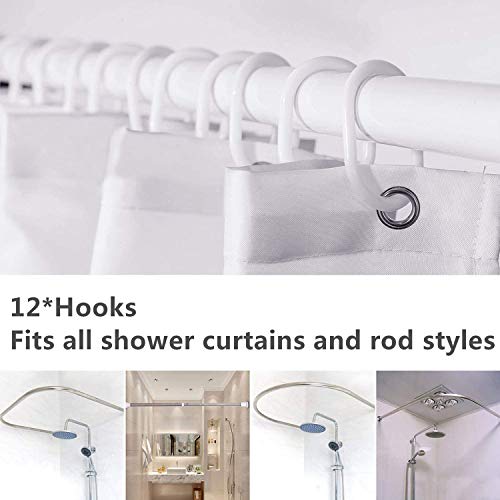
You are a GUI agent. You are given a task and a screenshot of the screen. Output one action in this format:
    pyautogui.click(x=<x>, y=<y>)
    Task: Click on the rod
    The width and height of the screenshot is (500, 500).
    Given the screenshot: What is the action you would take?
    pyautogui.click(x=429, y=109)